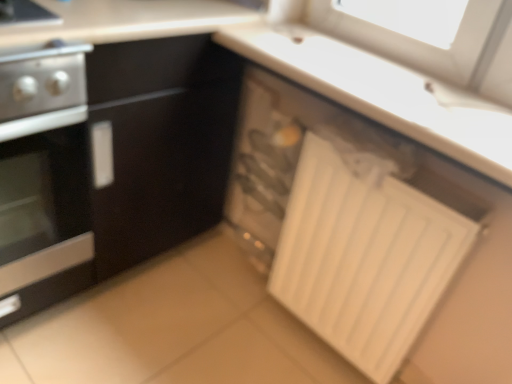
This screenshot has height=384, width=512. In order to click on white plastic drawer at lower right in this screenshot , I will do `click(262, 169)`.

Identify the location of white matte radiator at lower right. (364, 257).

What is the approximate width of stainless steel oven at left?

60.08 centimeters.

Find the location of a particular element. white plastic drawer at lower right is located at coordinates point(262,169).

From a real-world perspective, who is located lower, stainless steel oven at left or white plastic drawer at lower right?

From a 3D spatial view, white plastic drawer at lower right is below.

You are a GUI agent. You are given a task and a screenshot of the screen. Output one action in this format:
    pyautogui.click(x=<x>, y=<y>)
    Task: Click on the appliance behind the stainless steel oven at left
    This screenshot has height=384, width=512.
    Given the screenshot: What is the action you would take?
    pyautogui.click(x=262, y=169)

Is white plastic drawer at lower right inside stainless steel oven at left?

No, white plastic drawer at lower right is not surrounded by stainless steel oven at left.

Is stainless steel oven at left at the right side of white plastic drawer at lower right?

In fact, stainless steel oven at left is to the left of white plastic drawer at lower right.

Who is shorter, stainless steel oven at left or white matte radiator at lower right?

white matte radiator at lower right is shorter.

Considering the relative positions of stainless steel oven at left and white matte radiator at lower right in the image provided, is stainless steel oven at left behind white matte radiator at lower right?

No, it is in front of white matte radiator at lower right.

Locate an element on the screen. The image size is (512, 384). home appliance above the white matte radiator at lower right (from the image's perspective) is located at coordinates (42, 178).

Is stainless steel oven at left outside of white matte radiator at lower right?

Yes, stainless steel oven at left is outside of white matte radiator at lower right.

Considering the sizes of objects white plastic drawer at lower right and white matte radiator at lower right in the image provided, who is bigger, white plastic drawer at lower right or white matte radiator at lower right?

white matte radiator at lower right.

Is white plastic drawer at lower right in front of white matte radiator at lower right?

No, white plastic drawer at lower right is further to the viewer.

Measure the distance from white plastic drawer at lower right to white matte radiator at lower right.

white plastic drawer at lower right and white matte radiator at lower right are 11.34 inches apart from each other.

Considering the sizes of objects white plastic drawer at lower right and white matte radiator at lower right in the image provided, who is shorter, white plastic drawer at lower right or white matte radiator at lower right?

With less height is white plastic drawer at lower right.

Who is bigger, white matte radiator at lower right or white plastic drawer at lower right?

Bigger between the two is white matte radiator at lower right.

Considering the relative sizes of white matte radiator at lower right and white plastic drawer at lower right in the image provided, is white matte radiator at lower right shorter than white plastic drawer at lower right?

No.

From the image's perspective, is white matte radiator at lower right above or below white plastic drawer at lower right?

Based on their image positions, white matte radiator at lower right is located beneath white plastic drawer at lower right.

How far apart are white matte radiator at lower right and white plastic drawer at lower right?

A distance of 28.80 centimeters exists between white matte radiator at lower right and white plastic drawer at lower right.

Which is closer, (415,296) or (69,291)?

The point (415,296) is closer.

Is stainless steel oven at left at the back of white matte radiator at lower right?

No, white matte radiator at lower right is not facing away from stainless steel oven at left.

Does white matte radiator at lower right contain stainless steel oven at left?

That's incorrect, stainless steel oven at left is not inside white matte radiator at lower right.

From a real-world perspective, is white plastic drawer at lower right positioned above or below stainless steel oven at left?

From a real-world perspective, white plastic drawer at lower right is physically below stainless steel oven at left.

In the scene shown: What's the angular difference between white plastic drawer at lower right and stainless steel oven at left's facing directions?

white plastic drawer at lower right and stainless steel oven at left are facing 89 degrees away from each other.

From the image's perspective, which object appears higher, white plastic drawer at lower right or stainless steel oven at left?

stainless steel oven at left.

Does white plastic drawer at lower right have a lesser height compared to stainless steel oven at left?

Yes.

The image size is (512, 384). What are the coordinates of `home appliance in front of the white plastic drawer at lower right` in the screenshot? It's located at (42, 178).

You are a GUI agent. You are given a task and a screenshot of the screen. Output one action in this format:
    pyautogui.click(x=<x>, y=<y>)
    Task: Click on the radiator behind the stainless steel oven at left
    Image resolution: width=512 pixels, height=384 pixels.
    Given the screenshot: What is the action you would take?
    pyautogui.click(x=364, y=257)

Considering their positions, is white plastic drawer at lower right positioned further to white matte radiator at lower right than stainless steel oven at left?

stainless steel oven at left.

From the image, which object appears to be nearer to stainless steel oven at left, white plastic drawer at lower right or white matte radiator at lower right?

white plastic drawer at lower right lies closer to stainless steel oven at left than the other object.

Looking at the image, which one is located further to white plastic drawer at lower right, white matte radiator at lower right or stainless steel oven at left?

stainless steel oven at left lies further to white plastic drawer at lower right than the other object.

Based on their spatial positions, is stainless steel oven at left or white plastic drawer at lower right further from white matte radiator at lower right?

Based on the image, stainless steel oven at left appears to be further to white matte radiator at lower right.

Considering their positions, is stainless steel oven at left positioned closer to white plastic drawer at lower right than white matte radiator at lower right?

Among the two, white matte radiator at lower right is located nearer to white plastic drawer at lower right.

Estimate the real-world distances between objects in this image. Which object is closer to stainless steel oven at left, white matte radiator at lower right or white plastic drawer at lower right?

white plastic drawer at lower right lies closer to stainless steel oven at left than the other object.

Identify the location of appliance between stainless steel oven at left and white matte radiator at lower right. The width and height of the screenshot is (512, 384). (262, 169).